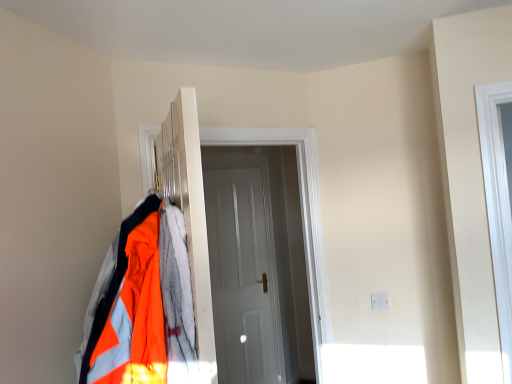
Question: From a real-world perspective, is metallic silver coat rack at center on top of white glossy door at center, the first door in the front-to-back sequence?

Choices:
 (A) yes
 (B) no

Answer: (A)

Question: Is the position of metallic silver coat rack at center less distant than that of white glossy door at center, positioned as the second door in back-to-front order?

Choices:
 (A) yes
 (B) no

Answer: (A)

Question: From a real-world perspective, is metallic silver coat rack at center beneath white glossy door at center, the first door in the front-to-back sequence?

Choices:
 (A) no
 (B) yes

Answer: (A)

Question: Is metallic silver coat rack at center at the left side of white glossy door at center, positioned as the second door in back-to-front order?

Choices:
 (A) no
 (B) yes

Answer: (B)

Question: Does metallic silver coat rack at center have a lesser height compared to white glossy door at center, positioned as the second door in back-to-front order?

Choices:
 (A) yes
 (B) no

Answer: (A)

Question: Considering the positions of metallic silver coat rack at center and white matte door at center, marked as the first door in a back-to-front arrangement, in the image, is metallic silver coat rack at center taller or shorter than white matte door at center, marked as the first door in a back-to-front arrangement,?

Choices:
 (A) tall
 (B) short

Answer: (B)

Question: Is point (140, 137) positioned closer to the camera than point (279, 327)?

Choices:
 (A) farther
 (B) closer

Answer: (B)

Question: From a real-world perspective, is metallic silver coat rack at center positioned above or below white matte door at center, marked as the first door in a back-to-front arrangement?

Choices:
 (A) above
 (B) below

Answer: (A)

Question: Is metallic silver coat rack at center situated inside white matte door at center, which is counted as the second door, starting from the front, or outside?

Choices:
 (A) inside
 (B) outside

Answer: (B)

Question: In the image, is white matte door at center, marked as the first door in a back-to-front arrangement, on the left side or the right side of reflective fabric jacket at left?

Choices:
 (A) right
 (B) left

Answer: (A)

Question: In terms of height, does white matte door at center, marked as the first door in a back-to-front arrangement, look taller or shorter compared to reflective fabric jacket at left?

Choices:
 (A) short
 (B) tall

Answer: (B)

Question: Is point (205, 205) closer or farther from the camera than point (128, 354)?

Choices:
 (A) farther
 (B) closer

Answer: (A)

Question: In the image, is white matte door at center, which is counted as the second door, starting from the front, positioned in front of or behind reflective fabric jacket at left?

Choices:
 (A) front
 (B) behind

Answer: (B)

Question: Is white glossy door at center, positioned as the second door in back-to-front order, inside the boundaries of white matte door at center, marked as the first door in a back-to-front arrangement, or outside?

Choices:
 (A) outside
 (B) inside

Answer: (A)

Question: In the image, is white glossy door at center, positioned as the second door in back-to-front order, positioned in front of or behind white matte door at center, which is counted as the second door, starting from the front?

Choices:
 (A) front
 (B) behind

Answer: (A)